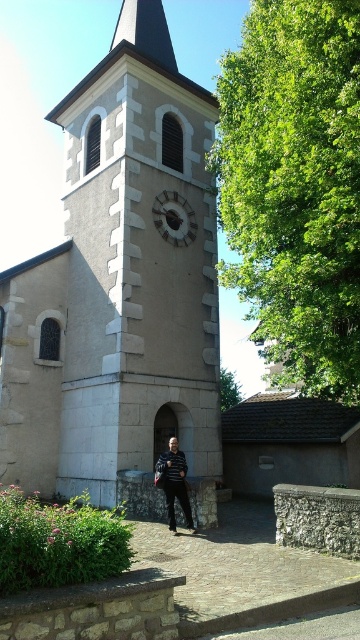
Does stone clock tower at center appear over matte gray clock at center?

Actually, stone clock tower at center is below matte gray clock at center.

Is stone clock tower at center shorter than matte gray clock at center?

No.

The width and height of the screenshot is (360, 640). Describe the element at coordinates (119, 291) in the screenshot. I see `stone clock tower at center` at that location.

In order to click on stone clock tower at center in this screenshot , I will do `click(119, 291)`.

Is matte gray clock at center smaller than striped sweater at center?

Actually, matte gray clock at center might be larger than striped sweater at center.

Between point (164, 204) and point (164, 493), which one is positioned in front?

Positioned in front is point (164, 493).

Does point (181, 241) come behind point (168, 456)?

Yes, it is.

In order to click on matte gray clock at center in this screenshot , I will do `click(173, 218)`.

Between stone clock tower at center and striped sweater at center, which one has more height?

With more height is stone clock tower at center.

Can you confirm if stone clock tower at center is positioned above striped sweater at center?

Indeed, stone clock tower at center is positioned over striped sweater at center.

Image resolution: width=360 pixels, height=640 pixels. Find the location of `stone clock tower at center`. stone clock tower at center is located at coordinates (119, 291).